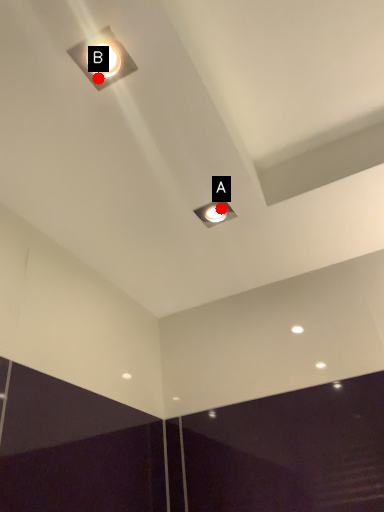
Question: Two points are circled on the image, labeled by A and B beside each circle. Which point is closer to the camera?

Choices:
 (A) A is closer
 (B) B is closer

Answer: (B)